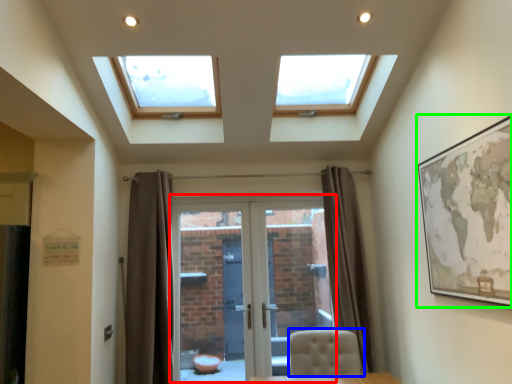
Question: Based on their relative distances, which object is nearer to door (highlighted by a red box)? Choose from chair (highlighted by a blue box) and picture frame (highlighted by a green box).

Choices:
 (A) chair
 (B) picture frame

Answer: (A)